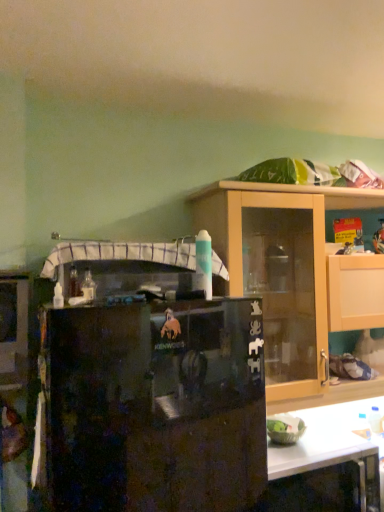
Question: Considering the positions of black matte refrigerator at center and wooden cabinet at upper right in the image, is black matte refrigerator at center taller or shorter than wooden cabinet at upper right?

Choices:
 (A) tall
 (B) short

Answer: (A)

Question: Is black matte refrigerator at center bigger or smaller than wooden cabinet at upper right?

Choices:
 (A) big
 (B) small

Answer: (A)

Question: Visually, is black matte refrigerator at center positioned to the left or to the right of wooden cabinet at upper right?

Choices:
 (A) right
 (B) left

Answer: (B)

Question: Is wooden cabinet at upper right inside or outside of black matte refrigerator at center?

Choices:
 (A) inside
 (B) outside

Answer: (B)

Question: In the image, is wooden cabinet at upper right positioned in front of or behind black matte refrigerator at center?

Choices:
 (A) behind
 (B) front

Answer: (A)

Question: Would you say wooden cabinet at upper right is to the left or to the right of black matte refrigerator at center in the picture?

Choices:
 (A) right
 (B) left

Answer: (A)

Question: Is wooden cabinet at upper right wider or thinner than black matte refrigerator at center?

Choices:
 (A) wide
 (B) thin

Answer: (B)